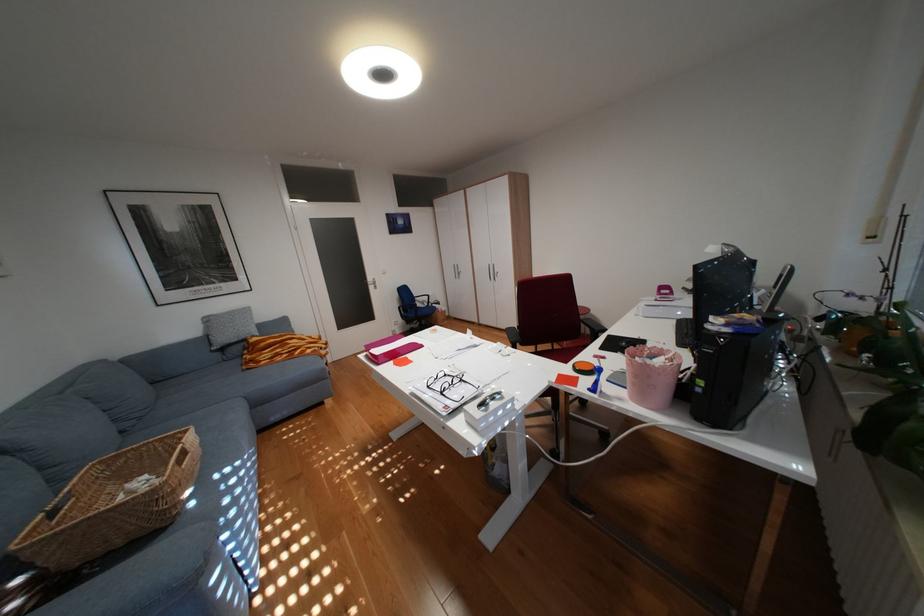
Find where to turn the silver door handle. Please return your answer as a coordinate pair (x, y).

(344, 325)